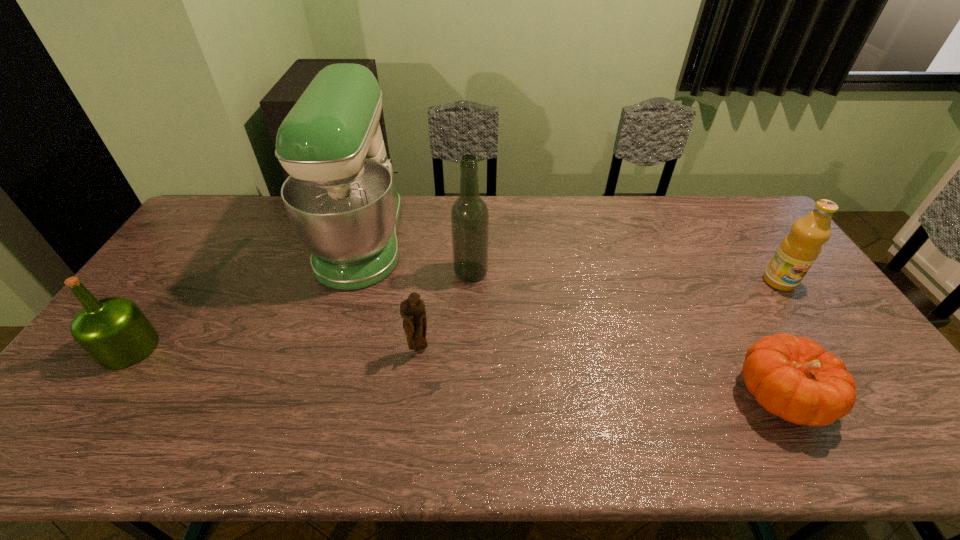
Where is `vacant area between the figurine and the leftmost object`? vacant area between the figurine and the leftmost object is located at coordinates (275, 349).

Identify the location of vacant region between the tallest object and the second object from right to left. The image size is (960, 540). (572, 318).

At what (x,y) coordinates should I click in order to perform the action: click on empty location between the pumpkin and the nearer olive oil. Please return your answer as a coordinate pair (x, y). This screenshot has width=960, height=540. Looking at the image, I should click on (455, 372).

I want to click on free area in between the second tallest object and the nearer olive oil, so click(300, 310).

Where is `free point between the liquor and the fourth object from right to left`? This screenshot has height=540, width=960. free point between the liquor and the fourth object from right to left is located at coordinates (445, 311).

Identify which object is the third nearest to the figurine. Please provide its 2D coordinates. Your answer should be formatted as a tuple, i.e. [(x, y)], where the tuple contains the x and y coordinates of a point satisfying the conditions above.

[(114, 331)]

Identify which object is the third nearest to the tallest object. Please provide its 2D coordinates. Your answer should be formatted as a tuple, i.e. [(x, y)], where the tuple contains the x and y coordinates of a point satisfying the conditions above.

[(114, 331)]

Image resolution: width=960 pixels, height=540 pixels. I want to click on free space that satisfies the following two spatial constraints: 1. on the controls of the fifth object from right to left; 2. on the right side of the fifth object from left to right, so click(316, 396).

The height and width of the screenshot is (540, 960). In order to click on free space in the image that satisfies the following two spatial constraints: 1. on the controls of the third object from right to left; 2. on the left side of the second object from left to right in this screenshot , I will do `click(353, 272)`.